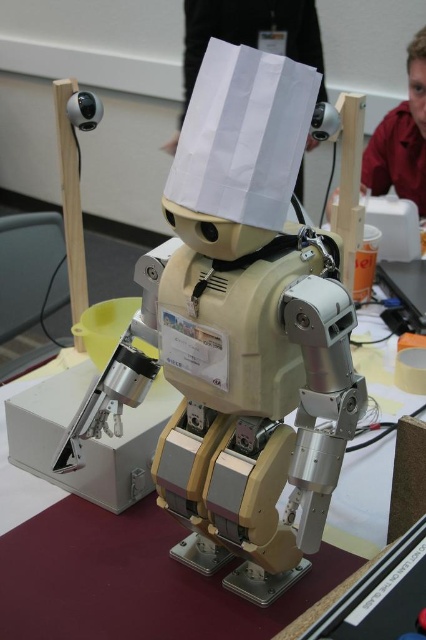
You are a guest at the tech exhibition and want to place a small snack on the metallic silver table at center. However, you also notice the white paper at upper center. Which object is larger in size, and why might that matter for placing your snack?

The white paper at upper center is larger than the metallic silver table at center. This means the snack might fit better on the white paper at upper center if you need more space, but the table is smaller and might not accommodate larger snacks.

You are a technician who needs to place a 2.0 meter long cable between the metallic silver table at center and the white paper at upper center. Will the cable be long enough to reach both objects?

The distance between the metallic silver table at center and the white paper at upper center is 2.10 meters. Since the cable is only 2.0 meters long, it is 0.10 meters shorter than required. The cable will not be long enough to reach both objects.